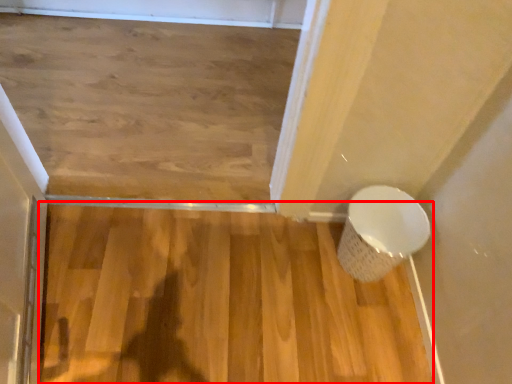
Question: From the image, what is the correct spatial relationship of hardwood (annotated by the red box) in relation to toilet?

Choices:
 (A) right
 (B) left

Answer: (B)